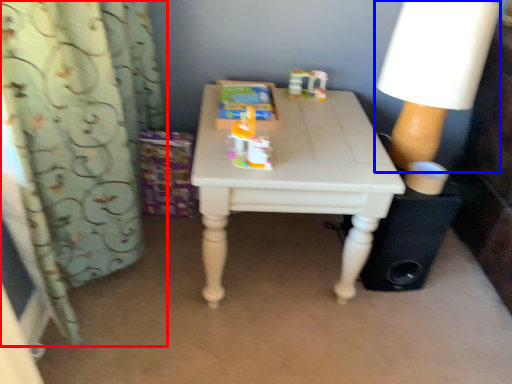
Question: Which object is further to the camera taking this photo, curtain (highlighted by a red box) or lamp (highlighted by a blue box)?

Choices:
 (A) curtain
 (B) lamp

Answer: (B)